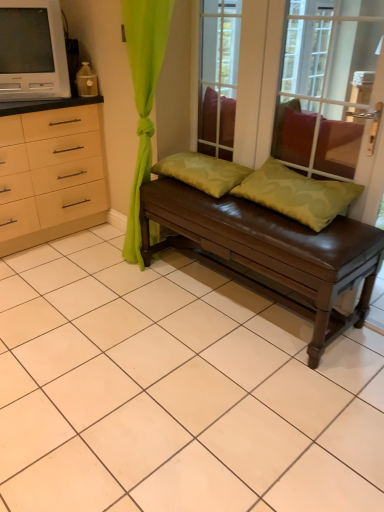
Question: In the image, is green fabric pillow at center, marked as the first pillow in a left-to-right arrangement, on the left side or the right side of brown leather bench at center?

Choices:
 (A) left
 (B) right

Answer: (A)

Question: From the image's perspective, is green fabric pillow at center, marked as the first pillow in a left-to-right arrangement, located above or below brown leather bench at center?

Choices:
 (A) above
 (B) below

Answer: (A)

Question: Estimate the real-world distances between objects in this image. Which object is closer to the matte white television at upper left?

Choices:
 (A) green fabric pillow at center, which ranks as the 2th pillow in right-to-left order
 (B) brown leather bench at center
 (C) green matte pillow at center, which is the second pillow from left to right
 (D) transparent glass window screen at upper center

Answer: (A)

Question: Considering the real-world distances, which object is closest to the brown leather bench at center?

Choices:
 (A) green matte pillow at center, which is the second pillow from left to right
 (B) matte white television at upper left
 (C) green fabric pillow at center, which ranks as the 2th pillow in right-to-left order
 (D) transparent glass window screen at upper center

Answer: (A)